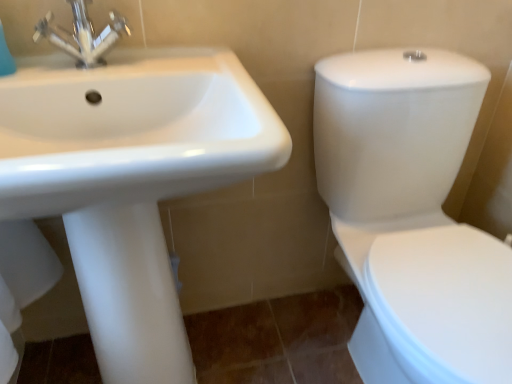
Question: Can you confirm if white glossy toilet at right is positioned to the left of white glossy sink at upper left?

Choices:
 (A) no
 (B) yes

Answer: (A)

Question: Could you tell me if white glossy toilet at right is facing white glossy sink at upper left?

Choices:
 (A) yes
 (B) no

Answer: (B)

Question: Is white glossy toilet at right thinner than white glossy sink at upper left?

Choices:
 (A) no
 (B) yes

Answer: (A)

Question: Is white glossy toilet at right positioned with its back to white glossy sink at upper left?

Choices:
 (A) no
 (B) yes

Answer: (A)

Question: Can you confirm if white glossy toilet at right is positioned to the right of white glossy sink at upper left?

Choices:
 (A) yes
 (B) no

Answer: (A)

Question: From a real-world perspective, is white glossy toilet at right under white glossy sink at upper left?

Choices:
 (A) no
 (B) yes

Answer: (B)

Question: From the image's perspective, is metallic chrome faucet at upper left located above white glossy toilet at right?

Choices:
 (A) yes
 (B) no

Answer: (A)

Question: Is white glossy toilet at right completely or partially inside metallic chrome faucet at upper left?

Choices:
 (A) no
 (B) yes

Answer: (A)

Question: Is metallic chrome faucet at upper left positioned before white glossy toilet at right?

Choices:
 (A) yes
 (B) no

Answer: (B)

Question: Is metallic chrome faucet at upper left next to white glossy toilet at right and touching it?

Choices:
 (A) no
 (B) yes

Answer: (A)

Question: From a real-world perspective, is metallic chrome faucet at upper left physically below white glossy toilet at right?

Choices:
 (A) yes
 (B) no

Answer: (B)

Question: Considering the relative sizes of metallic chrome faucet at upper left and white glossy toilet at right in the image provided, is metallic chrome faucet at upper left taller than white glossy toilet at right?

Choices:
 (A) no
 (B) yes

Answer: (A)

Question: Does white glossy sink at upper left have a smaller size compared to metallic chrome faucet at upper left?

Choices:
 (A) yes
 (B) no

Answer: (B)